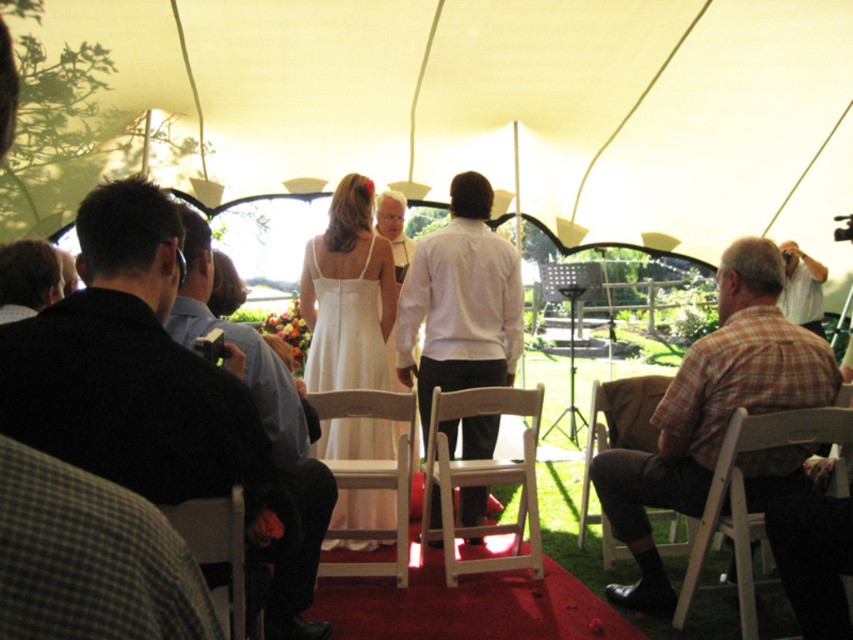
Question: Is dark blue shirt at center below white wood chair at lower right?

Choices:
 (A) yes
 (B) no

Answer: (B)

Question: Considering the real-world distances, which object is farthest from the wooden chair at lower left?

Choices:
 (A) white matte shirt at center
 (B) white shirt at right

Answer: (B)

Question: Does white wood folding chair at center have a smaller size compared to wooden chair at lower left?

Choices:
 (A) no
 (B) yes

Answer: (A)

Question: Among these objects, which one is farthest from the camera?

Choices:
 (A) white fabric canopy at center
 (B) black sweater at left
 (C) brown fabric chair at lower right

Answer: (A)

Question: Which of these objects is positioned farthest from the white wood chair at center?

Choices:
 (A) plaid shirt at center
 (B) white fabric canopy at center
 (C) black shirt at left

Answer: (B)

Question: Where is wooden chair at lower left located in relation to white shirt at right in the image?

Choices:
 (A) below
 (B) above

Answer: (A)